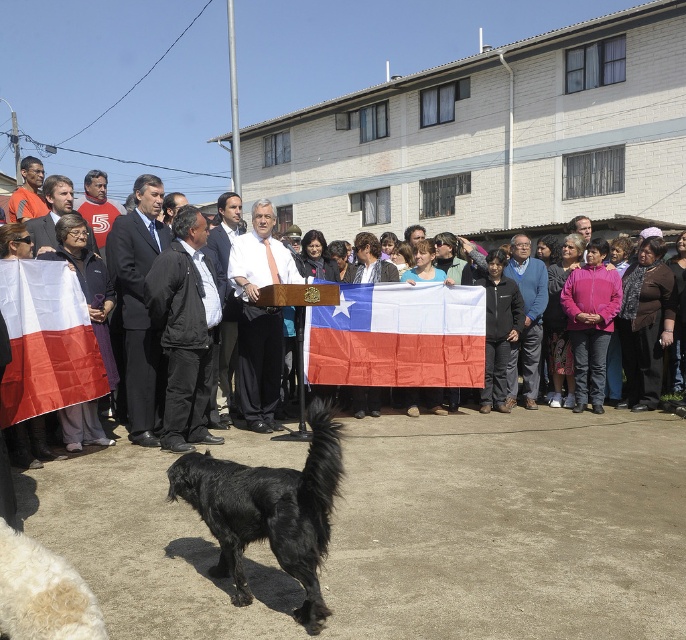
Question: Where is red fabric chilean flag at left located in relation to matte black suit at center in the image?

Choices:
 (A) below
 (B) above

Answer: (A)

Question: Where is dark suit at center located in relation to dark blue sweater at center in the image?

Choices:
 (A) above
 (B) below

Answer: (A)

Question: Among these points, which one is farthest from the camera?

Choices:
 (A) (99, 211)
 (B) (150, 404)
 (C) (34, 228)

Answer: (A)

Question: Can you confirm if black fluffy dog at lower left is positioned below orange shirt at left?

Choices:
 (A) no
 (B) yes

Answer: (B)

Question: Among these objects, which one is farthest from the camera?

Choices:
 (A) matte black dog at lower center
 (B) orange shirt at left
 (C) black fluffy dog at lower left
 (D) matte red shirt at center

Answer: (D)

Question: Which object is farther from the camera taking this photo?

Choices:
 (A) dark blue sweater at center
 (B) red fabric chilean flag at center

Answer: (A)